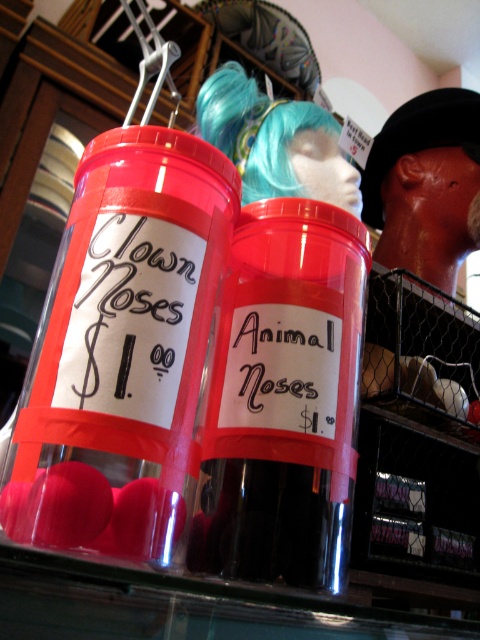
You are trying to determine if the matte plastic clown nose at left can fit into the transparent plastic container at center. Based on their widths, can it fit?

The matte plastic clown nose at left might be wider than transparent plastic container at center, so it might not fit inside.

From the picture: You are a customer at a novelty store and want to buy a clown nose. You see the matte plastic clown nose at left and the transparent plastic container at center. Which container should you check first to find the clown noses?

The matte plastic clown nose at left is to the left of the transparent plastic container at center, so the clown noses are likely in the container to the left of the transparent plastic container at center, which is the container labeled clown noses.